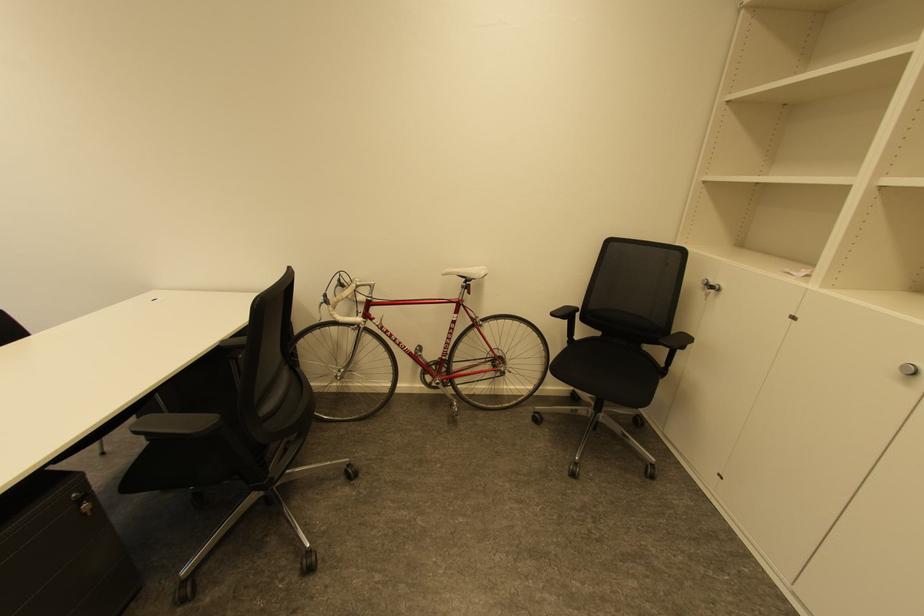
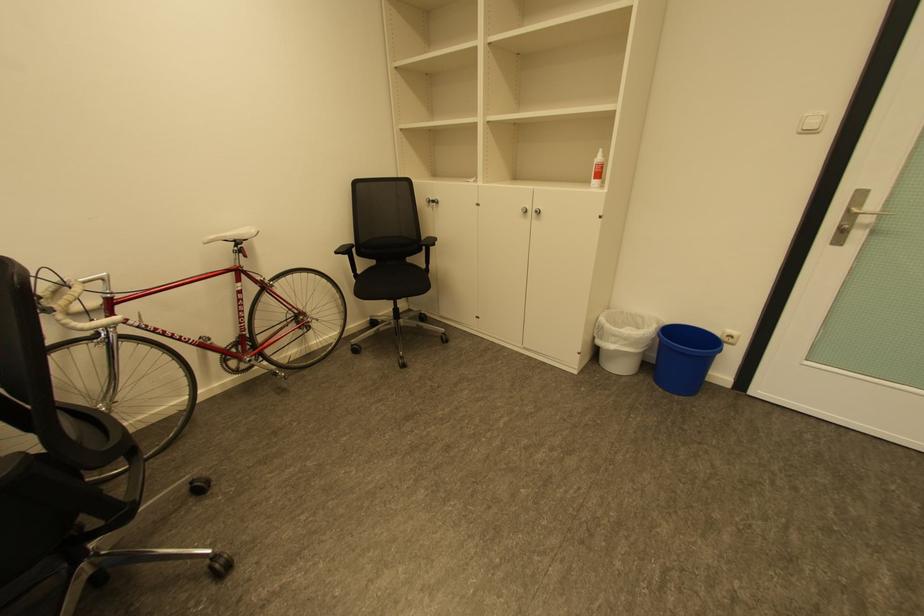
Locate, in the second image, the point that corresponds to [710,282] in the first image.

(433, 200)